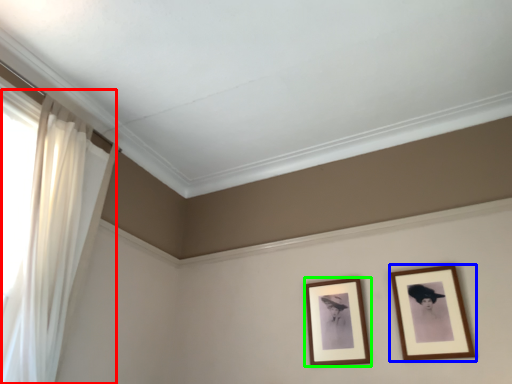
Question: Which object is the farthest from curtain (highlighted by a red box)? Choose among these: picture frame (highlighted by a blue box) or picture frame (highlighted by a green box).

Choices:
 (A) picture frame
 (B) picture frame

Answer: (A)